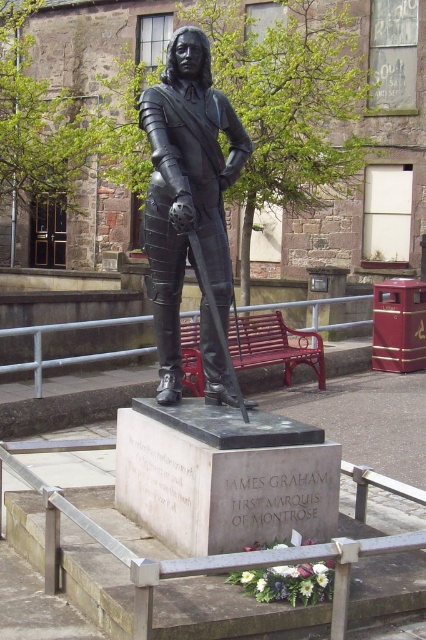
You are a tourist visiting the statue of James Graham. You want to take a photo of the bronze armor at center while sitting on the metallic red bench at center. Is the bench positioned in a way that allows you to see the armor clearly?

The bronze armor at center is located above the metallic red bench at center, so when sitting on the bench, you should be able to see the armor clearly as it is positioned above you.

You are a tour guide leading a group of visitors to the statue of James Graham. You want to ensure that the visitors can see the statue clearly from where they stand. If the recommended viewing distance for such statues is 4 meters, is the current distance of the bronze armor at center from the visitors sufficient?

The bronze armor at center is 4.41 meters away from the camera, which is slightly beyond the recommended 4 meters viewing distance. This means visitors can still see the statue clearly from that distance, as it is only 0.41 meters farther than the recommendation.